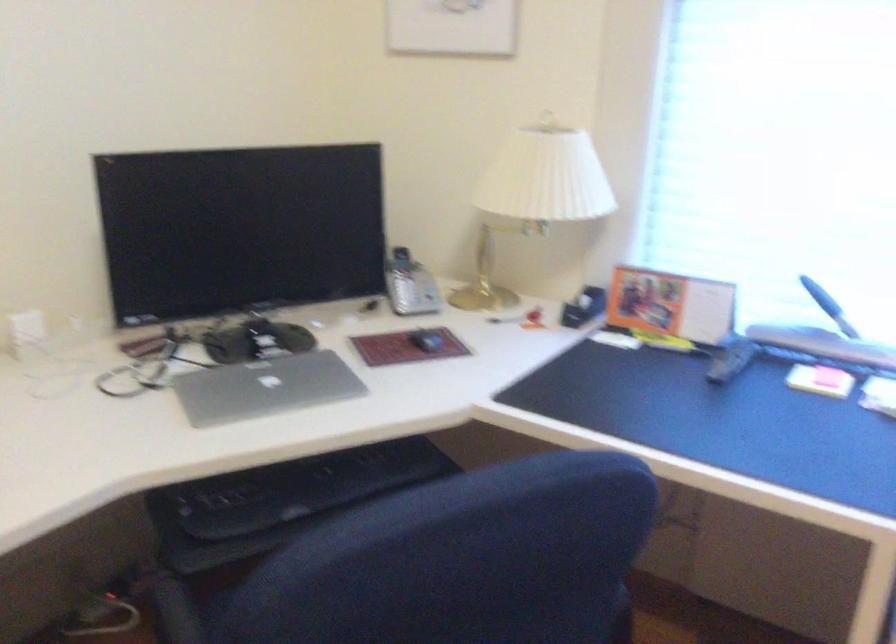
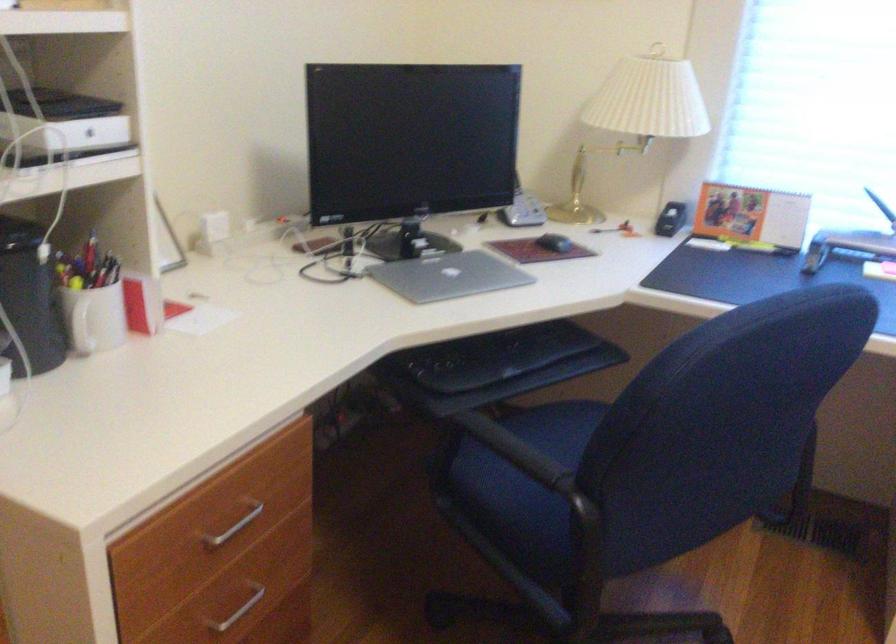
Locate, in the second image, the point that corresponds to point (288, 504) in the first image.

(494, 366)